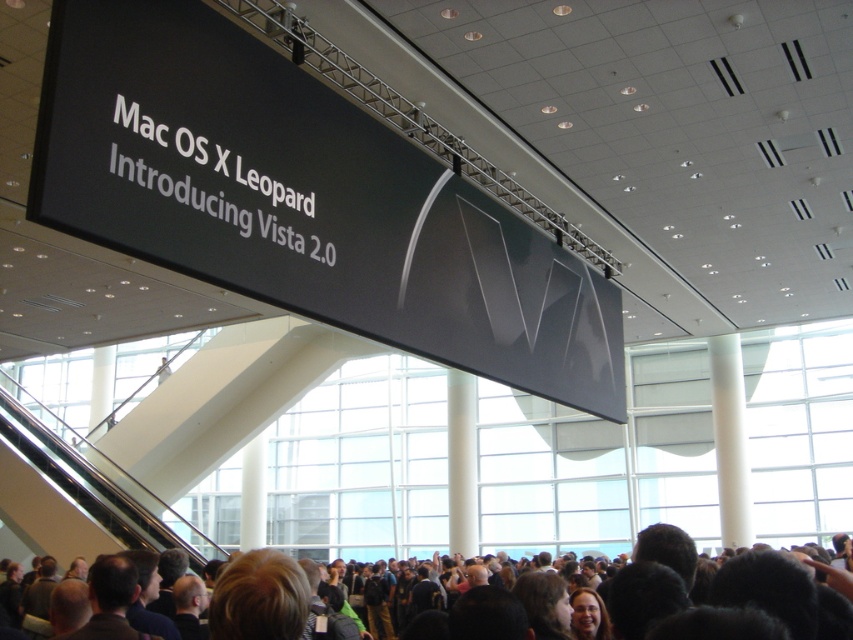
Question: Which object is the closest to the dark brown hair at lower center?

Choices:
 (A) black plastic escalator at lower left
 (B) black matte sign at upper center

Answer: (B)

Question: Can you confirm if dark brown hair at lower center is wider than black plastic escalator at lower left?

Choices:
 (A) yes
 (B) no

Answer: (A)

Question: Which object appears farthest from the camera in this image?

Choices:
 (A) black plastic escalator at lower left
 (B) black matte sign at upper center
 (C) dark brown hair at lower center

Answer: (A)

Question: Does dark brown hair at lower center come in front of black plastic escalator at lower left?

Choices:
 (A) yes
 (B) no

Answer: (A)

Question: Which of the following is the closest to the observer?

Choices:
 (A) (840, 573)
 (B) (132, 176)

Answer: (A)

Question: Is black matte sign at upper center above dark brown hair at lower center?

Choices:
 (A) no
 (B) yes

Answer: (B)